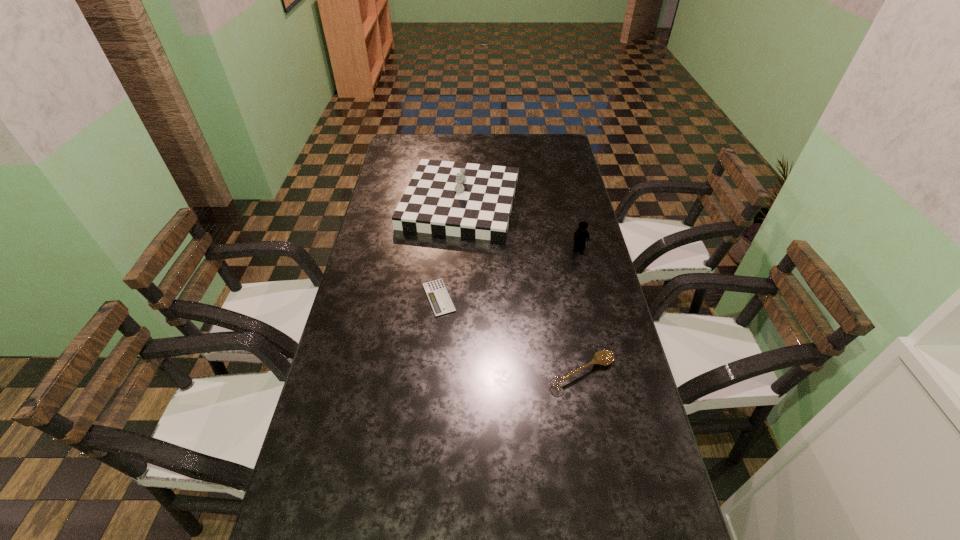
Identify the location of free location located on the left of the third tallest object. (489, 372).

Locate an element on the screen. Image resolution: width=960 pixels, height=540 pixels. free space located on the right of the calculator is located at coordinates (507, 298).

The height and width of the screenshot is (540, 960). In order to click on object located at the left edge in this screenshot , I will do `click(468, 200)`.

The width and height of the screenshot is (960, 540). What are the coordinates of `Lego that is at the right edge` in the screenshot? It's located at pos(580,236).

The width and height of the screenshot is (960, 540). I want to click on ladle at the right edge, so click(x=603, y=357).

In the image, there is a desktop. Where is `free space at the far edge`? The width and height of the screenshot is (960, 540). free space at the far edge is located at coordinates coord(463,148).

In order to click on vacant area at the left edge in this screenshot , I will do `click(391, 197)`.

What are the coordinates of `free space at the right edge of the desktop` in the screenshot? It's located at (621, 538).

Locate an element on the screen. This screenshot has height=540, width=960. vacant point at the far left corner is located at coordinates click(397, 145).

This screenshot has width=960, height=540. What are the coordinates of `free space at the far right corner` in the screenshot? It's located at (562, 145).